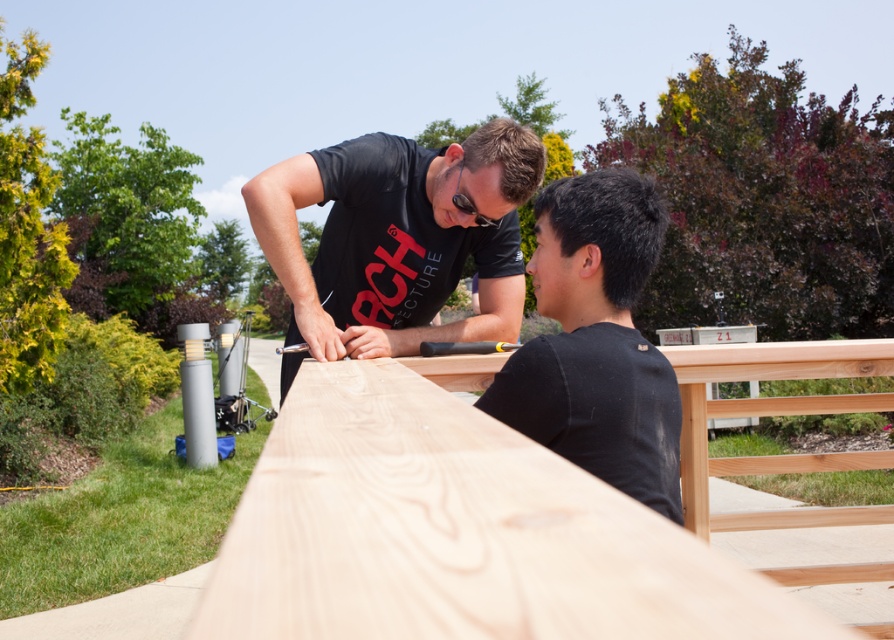
Question: Which point is closer to the camera taking this photo?

Choices:
 (A) (631, 616)
 (B) (545, 241)

Answer: (A)

Question: Which of the following is the closest to the observer?

Choices:
 (A) natural light wood at center
 (B) black matte shirt at upper right
 (C) matte black shirt at upper center

Answer: (A)

Question: In this image, where is natural light wood at center located relative to matte black shirt at upper center?

Choices:
 (A) right
 (B) left

Answer: (A)

Question: Is natural light wood at center thinner than matte black shirt at upper center?

Choices:
 (A) no
 (B) yes

Answer: (B)

Question: Which object is the farthest from the black matte shirt at upper right?

Choices:
 (A) matte black shirt at upper center
 (B) natural light wood at center

Answer: (A)

Question: Can you confirm if matte black shirt at upper center is positioned above black matte shirt at upper right?

Choices:
 (A) yes
 (B) no

Answer: (A)